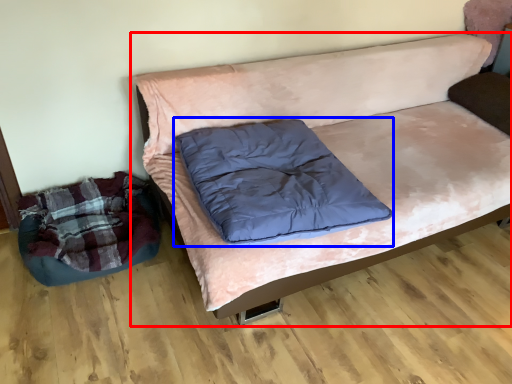
Question: Which object is closer to the camera taking this photo, studio couch (highlighted by a red box) or pillow (highlighted by a blue box)?

Choices:
 (A) studio couch
 (B) pillow

Answer: (A)